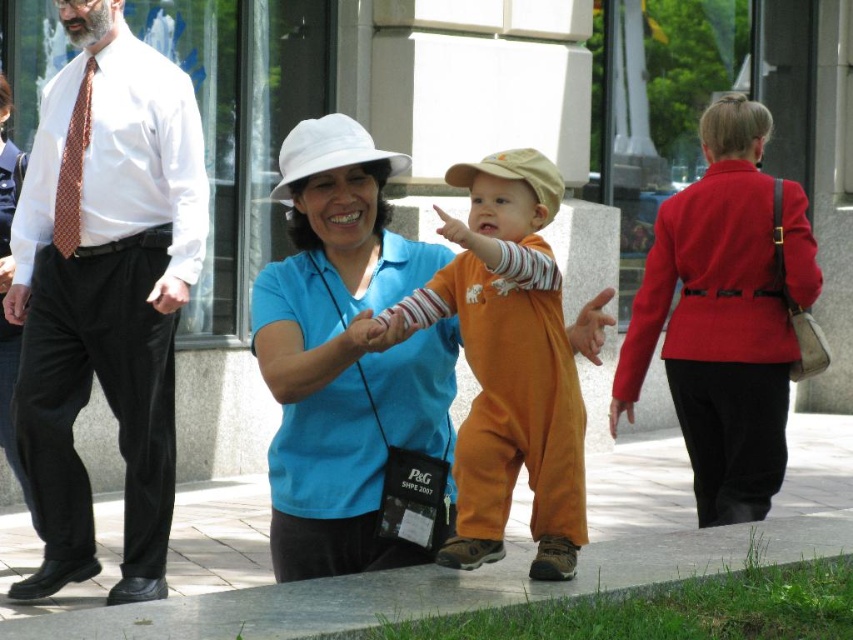
Between point (354, 618) and point (445, 442), which one is positioned behind?

Point (445, 442)

Between point (675, 544) and point (372, 324), which one is positioned behind?

The point (675, 544) is behind.

In order to click on paved stone sidewalk at center in this screenshot , I will do `click(369, 573)`.

Is blue cotton shirt at center to the left of matte orange jumpsuit at center from the viewer's perspective?

Correct, you'll find blue cotton shirt at center to the left of matte orange jumpsuit at center.

From the picture: Is blue cotton shirt at center smaller than matte orange jumpsuit at center?

Yes, blue cotton shirt at center is smaller than matte orange jumpsuit at center.

Identify the location of blue cotton shirt at center. The width and height of the screenshot is (853, 640). (344, 355).

Is matte brown tie at left further to the viewer compared to orange cotton jumpsuit at center?

Yes, matte brown tie at left is behind orange cotton jumpsuit at center.

Is matte brown tie at left thinner than orange cotton jumpsuit at center?

No, matte brown tie at left is not thinner than orange cotton jumpsuit at center.

Identify the location of matte brown tie at left. (105, 291).